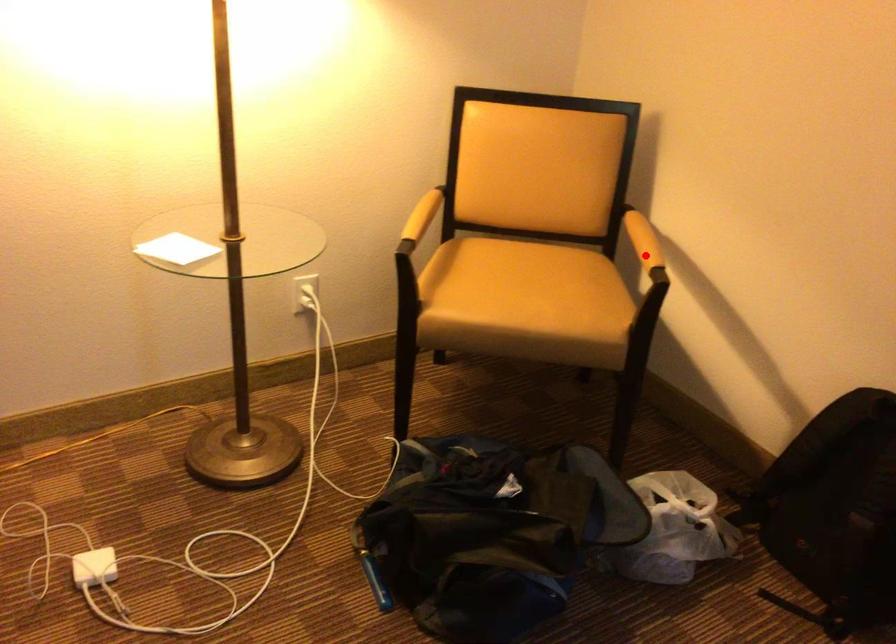
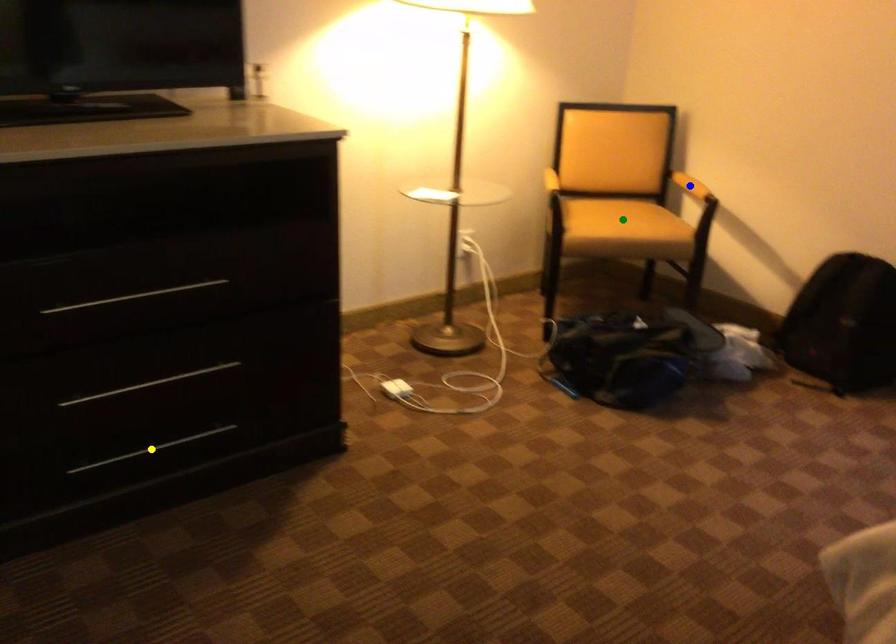
Question: I am providing you with two images of the same scene from different viewpoints. A red point is marked on the first image. You are given multiple points on the second image. Which point in image 2 is actually the same real-world point as the red point in image 1?

Choices:
 (A) blue point
 (B) yellow point
 (C) green point

Answer: (A)